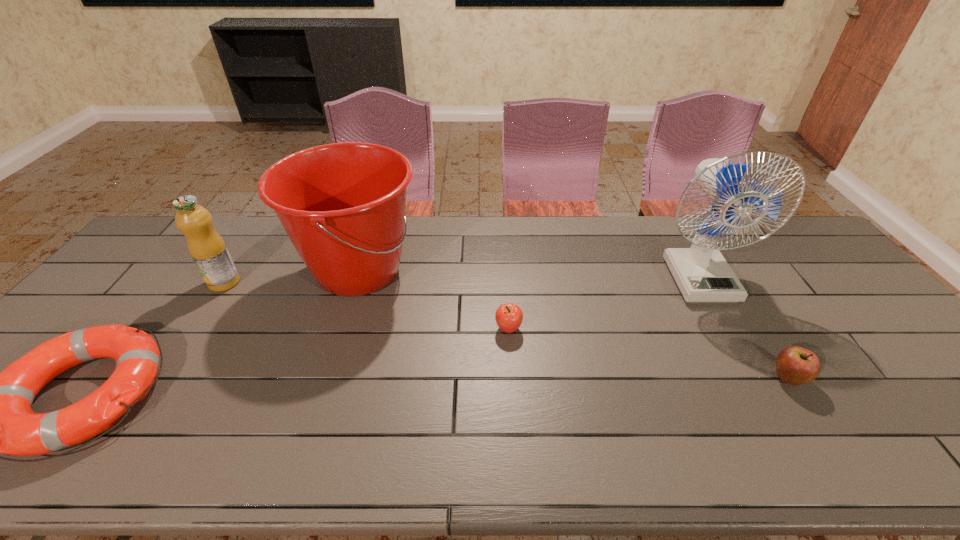
The width and height of the screenshot is (960, 540). What are the coordinates of `vacant region between the bucket and the left apple` in the screenshot? It's located at (434, 300).

Where is `free space between the bucket and the nearer apple`? The image size is (960, 540). free space between the bucket and the nearer apple is located at coordinates (573, 325).

The height and width of the screenshot is (540, 960). Identify the location of unoccupied position between the fourth shortest object and the bucket. (292, 276).

Point out which object is positioned as the nearest to the fruit juice. Please provide its 2D coordinates. Your answer should be formatted as a tuple, i.e. [(x, y)], where the tuple contains the x and y coordinates of a point satisfying the conditions above.

[(342, 205)]

Locate which object ranks second in proximity to the farther apple. Please provide its 2D coordinates. Your answer should be formatted as a tuple, i.e. [(x, y)], where the tuple contains the x and y coordinates of a point satisfying the conditions above.

[(702, 274)]

Image resolution: width=960 pixels, height=540 pixels. Identify the location of blank area in the image that satisfies the following two spatial constraints: 1. on the front label of the fruit juice; 2. on the left side of the third object from right to left. click(194, 329).

Where is `free space that satisfies the following two spatial constraints: 1. with the handle attached to the rim of the bucket; 2. on the back side of the nearer apple`? free space that satisfies the following two spatial constraints: 1. with the handle attached to the rim of the bucket; 2. on the back side of the nearer apple is located at coordinates (324, 379).

Find the location of a particular element. vacant position in the image that satisfies the following two spatial constraints: 1. on the front label of the fourth object from left to right; 2. on the right side of the fruit juice is located at coordinates (194, 329).

At what (x,y) coordinates should I click in order to perform the action: click on free space that satisfies the following two spatial constraints: 1. on the front label of the fruit juice; 2. on the left side of the right apple. Please return your answer as a coordinate pair (x, y). This screenshot has height=540, width=960. Looking at the image, I should click on (161, 379).

This screenshot has height=540, width=960. In order to click on free point that satisfies the following two spatial constraints: 1. on the front-facing side of the fourth tallest object; 2. on the left side of the fan in this screenshot , I will do `click(755, 379)`.